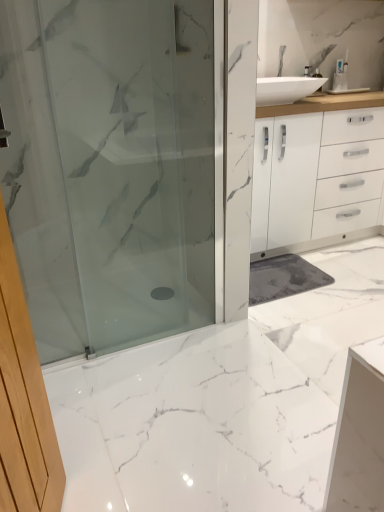
Identify the location of vacant space behind satin glass shower door at center. (151, 310).